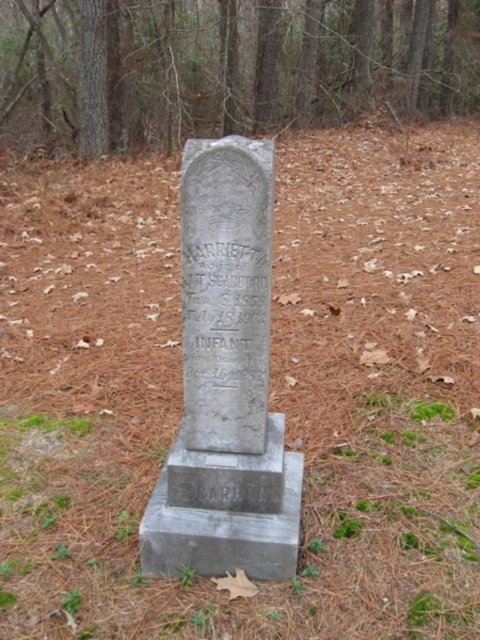
You are an archaeologist examining the gravestone in the forest. You notice a specific point on the gravestone marked at coordinates (226,67). What material is present at this point?

The point at (226,67) indicates smooth gray stone at center, so the material present is smooth gray stone.

You are standing in front of the gravestone in the forest. You notice two points marked on the gravestone. One is at coordinate point (60, 26) and the other is at point (284, 579). If you were to walk from the first point to the second point, would you be moving towards the top or bottom of the gravestone?

Moving towards the bottom of the gravestone because point (284, 579) is below point (60, 26).